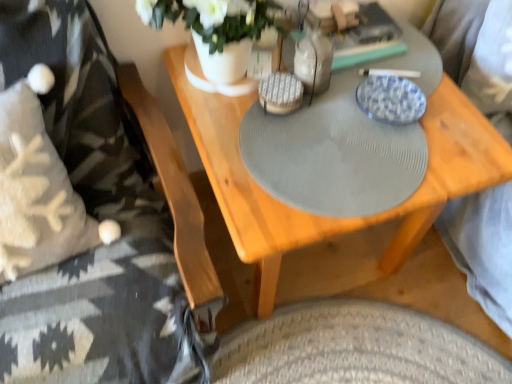
Image resolution: width=512 pixels, height=384 pixels. I want to click on free location to the left of clear glass bottle at center, so 224,114.